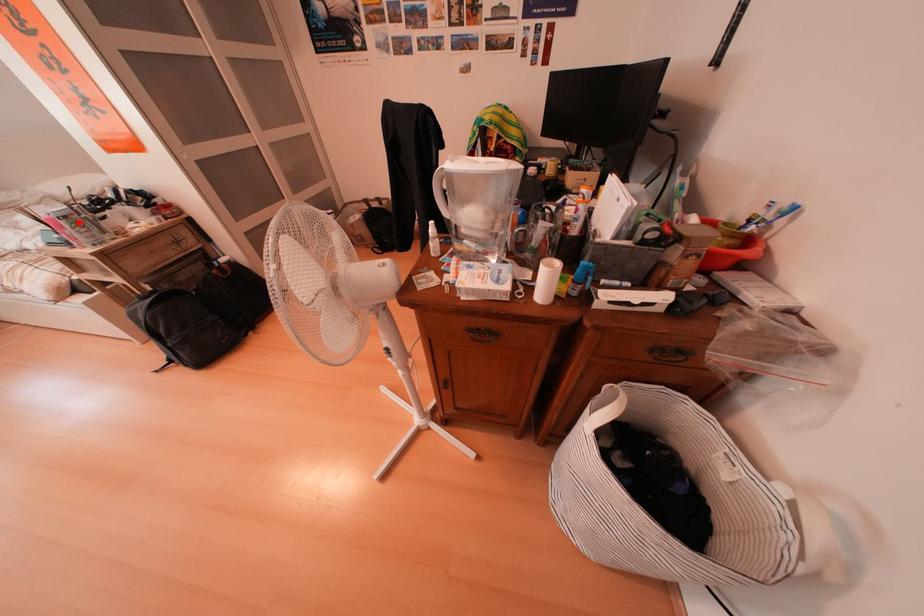
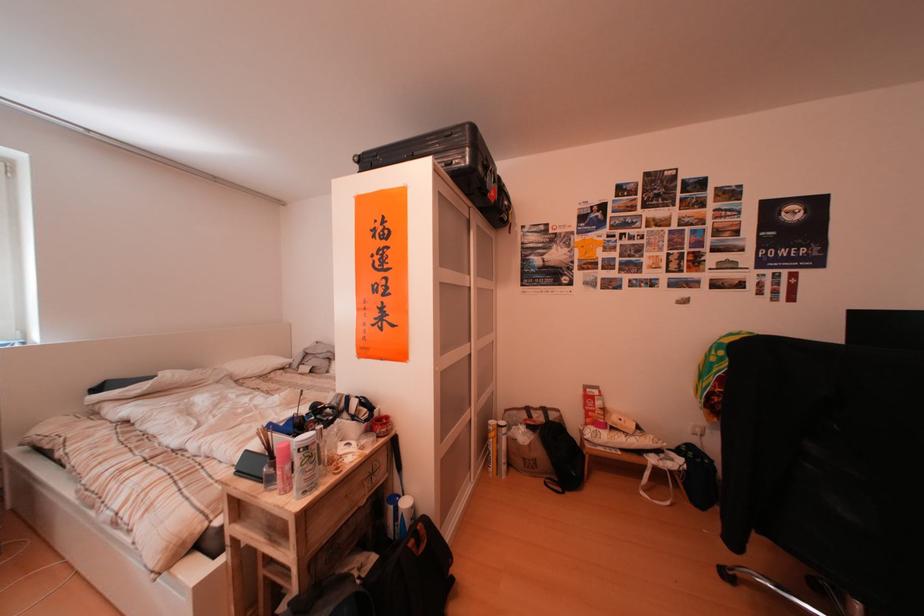
Find the pixel in the second image that matches the highlighted location in the first image.

(320, 453)